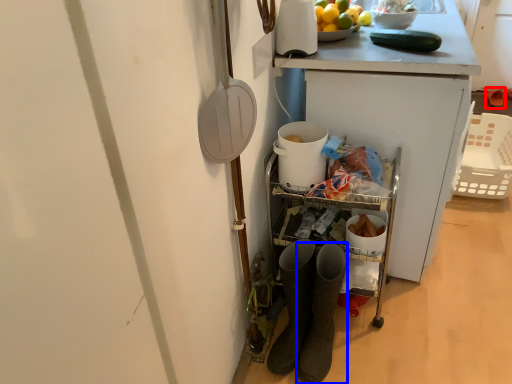
Question: Which point is further to the camera, footwear (highlighted by a red box) or footwear (highlighted by a blue box)?

Choices:
 (A) footwear
 (B) footwear

Answer: (A)